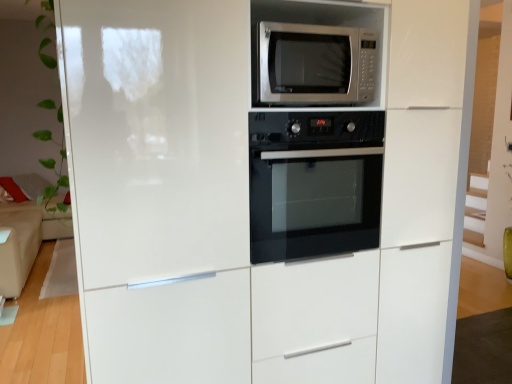
At what (x,y) coordinates should I click in order to perform the action: click on free location above black glass oven at center (from a real-world perspective). Please return your answer as a coordinate pair (x, y). This screenshot has width=512, height=384. Looking at the image, I should click on (320, 109).